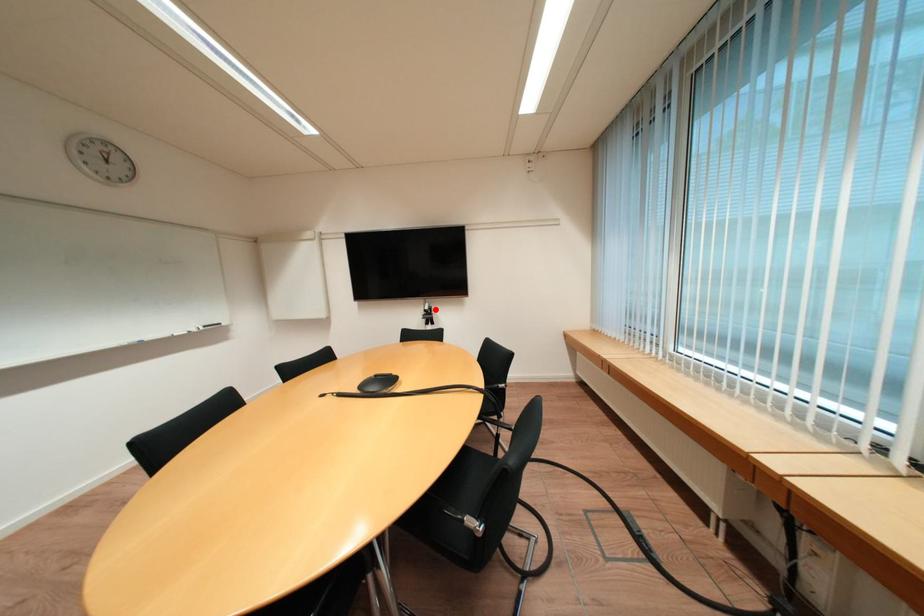
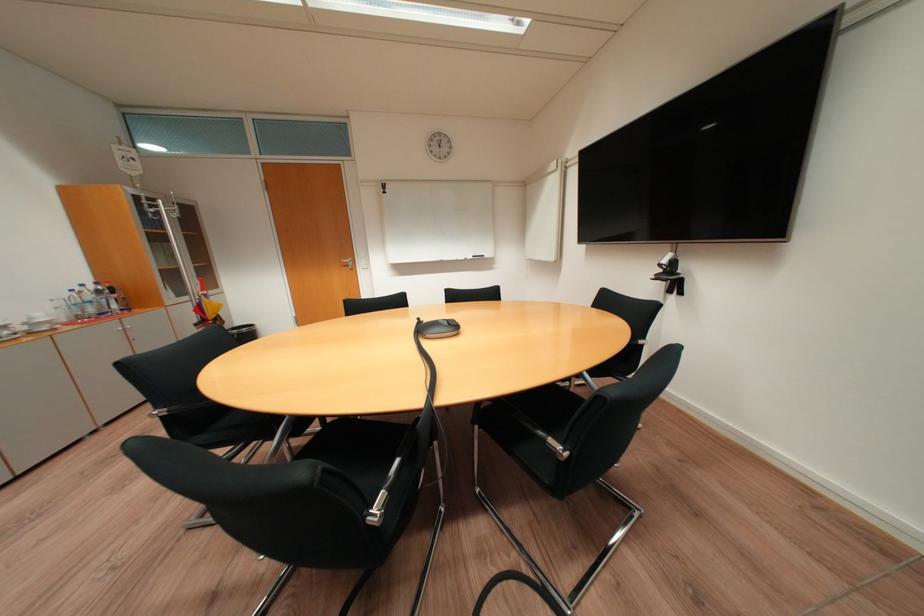
Locate, in the second image, the point that corresponds to the highlighted location in the first image.

(673, 262)